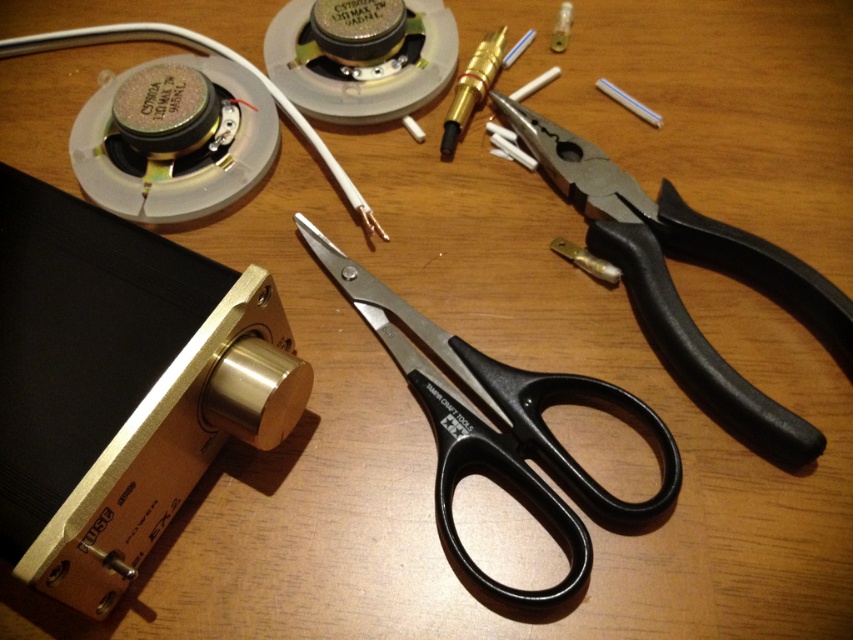
Is point (448, 483) behind point (300, 120)?

That is False.

What do you see at coordinates (503, 433) in the screenshot? I see `black plastic scissors at center` at bounding box center [503, 433].

The height and width of the screenshot is (640, 853). In order to click on black plastic scissors at center in this screenshot , I will do `click(503, 433)`.

Where is `black plastic scissors at center`? The height and width of the screenshot is (640, 853). black plastic scissors at center is located at coordinates (503, 433).

Who is lower down, gold metallic knob at center or gold-plated connector at upper center?

gold metallic knob at center is below.

Is point (25, 442) farther from camera compared to point (479, 90)?

No, (25, 442) is closer to viewer.

Which is behind, point (107, 605) or point (444, 144)?

The point (444, 144) is behind.

At what (x,y) coordinates should I click in order to perform the action: click on gold metallic knob at center. Please return your answer as a coordinate pair (x, y). The height and width of the screenshot is (640, 853). Looking at the image, I should click on (120, 385).

Is white matte wire at upper left to the left of gold-plated connector at upper center from the viewer's perspective?

Indeed, white matte wire at upper left is positioned on the left side of gold-plated connector at upper center.

Who is positioned more to the left, white matte wire at upper left or gold-plated connector at upper center?

Positioned to the left is white matte wire at upper left.

The height and width of the screenshot is (640, 853). I want to click on white matte wire at upper left, so click(202, 52).

You are a GUI agent. You are given a task and a screenshot of the screen. Output one action in this format:
    pyautogui.click(x=<x>, y=<y>)
    Task: Click on the white matte wire at upper left
    Image resolution: width=853 pixels, height=640 pixels.
    Given the screenshot: What is the action you would take?
    pyautogui.click(x=202, y=52)